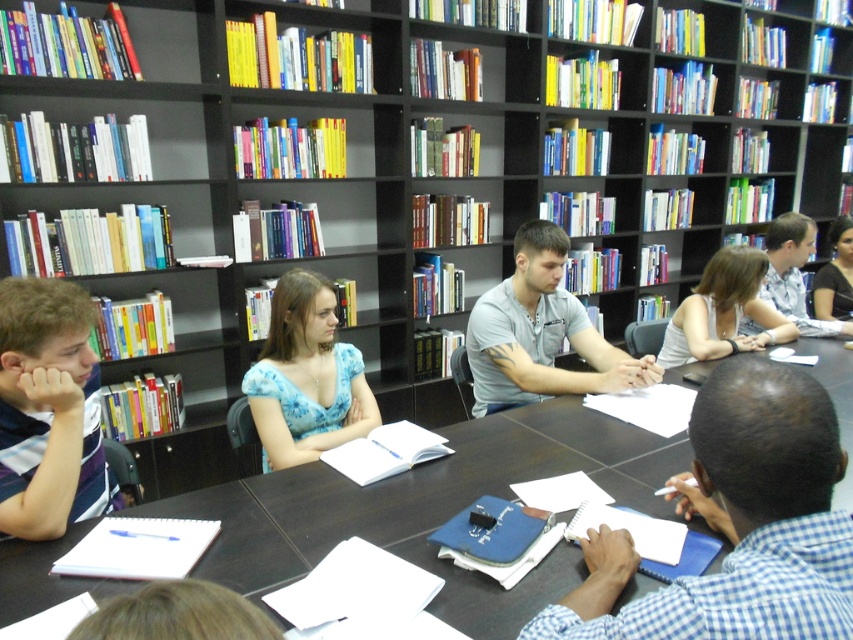
You are standing at the entrance of the library room. Where is the dark wood table at center located in terms of coordinates?

The dark wood table at center is located at coordinates point (x=430, y=508).

You are standing at the entrance of the library room and want to approach the dark wood table at center and the light brown hair at upper right. Which object is closer to your current position?

The dark wood table at center is closer to your current position because it is to the left of the light brown hair at upper right, implying it is positioned nearer to the entrance.